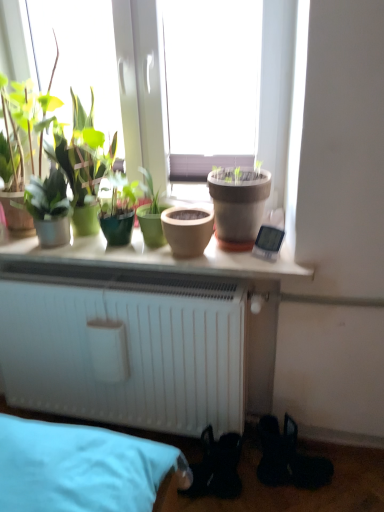
Question: In the image, is matte clay pot at center, which appears as the second flowerpot when viewed from the left, positioned in front of or behind green matte plant at left, which is counted as the 1th houseplant, starting from the left?

Choices:
 (A) behind
 (B) front

Answer: (B)

Question: Is point (241, 199) positioned closer to the camera than point (54, 204)?

Choices:
 (A) closer
 (B) farther

Answer: (A)

Question: Which object is positioned closest to the matte clay pot at center?

Choices:
 (A) green matte pot at center, the 2th houseplant when ordered from left to right
 (B) green matte plant at left, which is counted as the 1th houseplant, starting from the left
 (C) matte clay pot at center, which is counted as the first flowerpot, starting from the right
 (D) matte clay pot at center, arranged as the 1th flowerpot when viewed from the left

Answer: (D)

Question: Considering the real-world distances, which object is closest to the matte clay pot at center, which appears as the second flowerpot when viewed from the left?

Choices:
 (A) green matte plant at left, which is counted as the 1th houseplant, starting from the left
 (B) green matte pot at center, the 2th houseplant when ordered from left to right
 (C) matte clay pot at center
 (D) matte clay pot at center, which is the second flowerpot from right to left

Answer: (D)